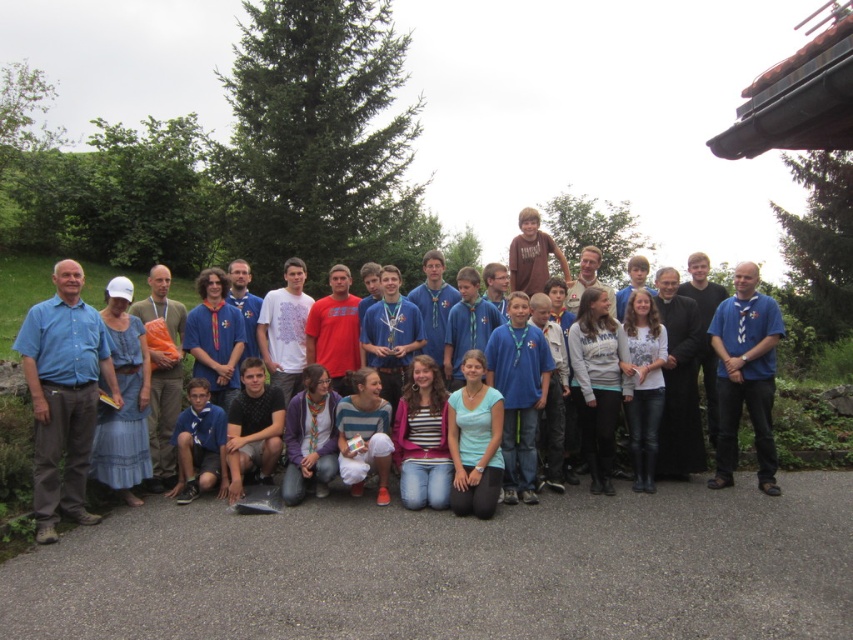
Question: Which of the following is the closest to the observer?

Choices:
 (A) black cotton t-shirt at lower center
 (B) blue shirt at left
 (C) blue fabric shirt at center

Answer: (B)

Question: Considering the relative positions of light blue cotton shirt at center and white matte shirt at center in the image provided, where is light blue cotton shirt at center located with respect to white matte shirt at center?

Choices:
 (A) above
 (B) below

Answer: (B)

Question: Is matte blue shirt at left to the left of brown cotton shirt at center from the viewer's perspective?

Choices:
 (A) no
 (B) yes

Answer: (B)

Question: Which point is closer to the camera?

Choices:
 (A) (248, 378)
 (B) (463, 467)
 (C) (57, 388)
 (D) (527, 230)

Answer: (C)

Question: Which point appears closest to the camera in this image?

Choices:
 (A) (312, 378)
 (B) (228, 490)
 (C) (183, 365)

Answer: (B)

Question: Is matte blue shirt at left above purple fleece jacket at lower center?

Choices:
 (A) yes
 (B) no

Answer: (A)